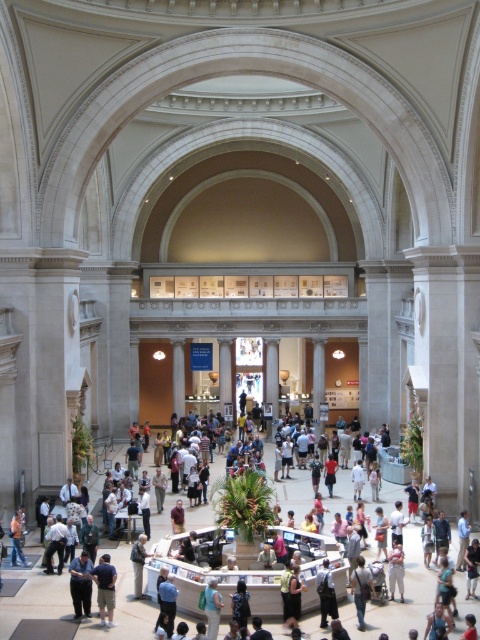
You are a visitor in the museum and want to take a photo of the light blue jeans at center and dark gray shirt at center. Which one should you focus on to ensure they both fit in the frame without cropping?

Since the light blue jeans at center occupies less space than dark gray shirt at center, you should focus on the dark gray shirt at center to ensure both fit in the frame without cropping.

You are standing at the entrance of the grand classical building and see the light brown leather jacket at center. If you want to reach the jacket, which direction should you move relative to your current position?

The light brown leather jacket at center is located at point 0.936 on the x axis and 0.829 on the y axis. Since the entrance is typically at the lower left corner of the image, you should move towards the right and upwards to reach the jacket.

You are standing in the grand classical building and notice a light brown leather jacket at center and denim pants at center. If you want to pick up both items, which one should you go to first to minimize the distance you walk?

The light brown leather jacket at center and denim pants at center are 13.31 meters apart from each other. To minimize the distance walked, you should pick up whichever item is closer to your current position. However, since their exact positions relative to you aren not specified, you can choose either one first and then walk 13.31 meters to the other.